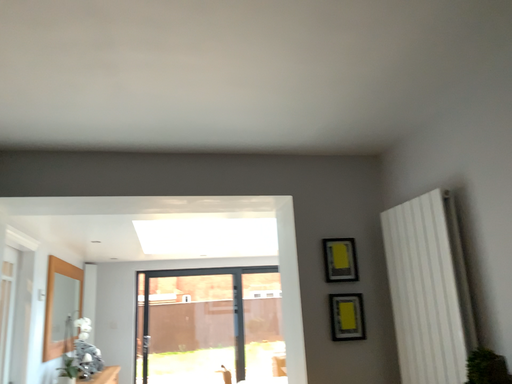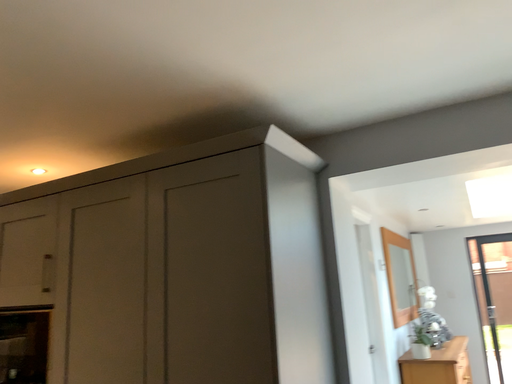
Question: How did the camera likely rotate when shooting the video?

Choices:
 (A) rotated downward
 (B) rotated upward

Answer: (A)